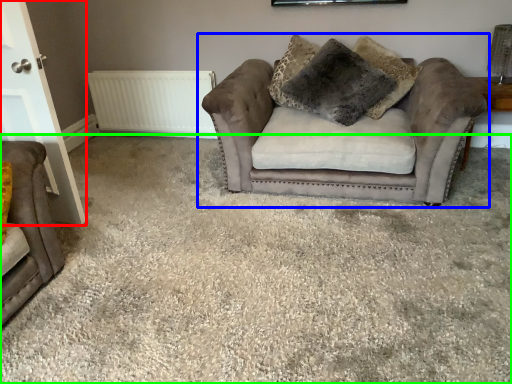
Question: Estimate the real-world distances between objects in this image. Which object is closer to door (highlighted by a red box), studio couch (highlighted by a blue box) or plain (highlighted by a green box)?

Choices:
 (A) studio couch
 (B) plain

Answer: (B)